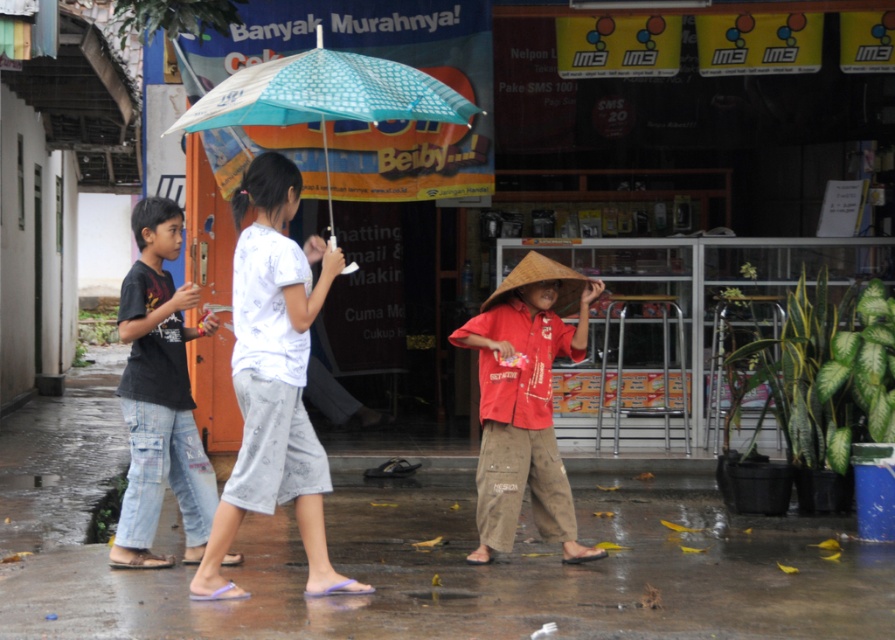
Question: Is wet concrete pavement at lower center positioned behind teal printed fabric umbrella at upper center?

Choices:
 (A) yes
 (B) no

Answer: (A)

Question: Does wet concrete pavement at lower center lie behind dark blue jeans at left?

Choices:
 (A) no
 (B) yes

Answer: (A)

Question: Which object is closer to the camera taking this photo?

Choices:
 (A) white cotton shirt at center
 (B) teal printed fabric umbrella at upper center
 (C) dark blue jeans at left
 (D) wet concrete pavement at lower center

Answer: (A)

Question: Which object appears closest to the camera in this image?

Choices:
 (A) white cotton shirt at center
 (B) dark blue jeans at left

Answer: (A)

Question: Where is dark blue jeans at left located in relation to teal printed fabric umbrella at upper center in the image?

Choices:
 (A) above
 (B) below

Answer: (B)

Question: Which point is closer to the camera taking this photo?

Choices:
 (A) (531, 288)
 (B) (198, 554)
 (C) (263, 380)

Answer: (C)